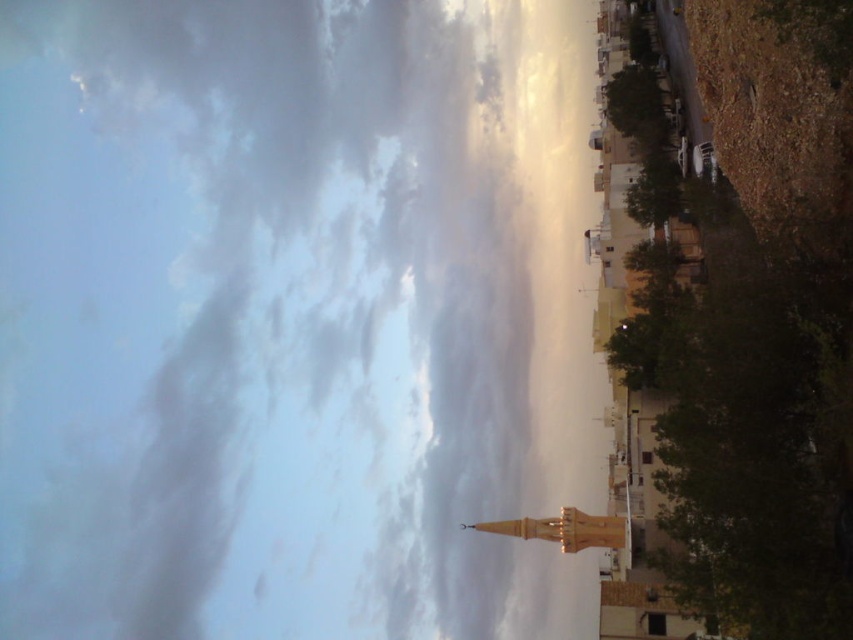
Between point (360, 452) and point (618, 540), which one is positioned in front?

Point (618, 540)

Is cloudy sky at upper center bigger than light brown wooden tower at lower center?

Yes, cloudy sky at upper center is bigger than light brown wooden tower at lower center.

Which is in front, point (122, 40) or point (463, 524)?

Point (463, 524)

The width and height of the screenshot is (853, 640). I want to click on cloudy sky at upper center, so click(x=310, y=330).